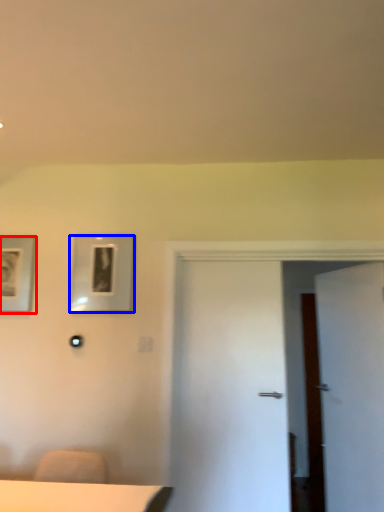
Question: Which object is further to the camera taking this photo, picture frame (highlighted by a red box) or picture frame (highlighted by a blue box)?

Choices:
 (A) picture frame
 (B) picture frame

Answer: (A)